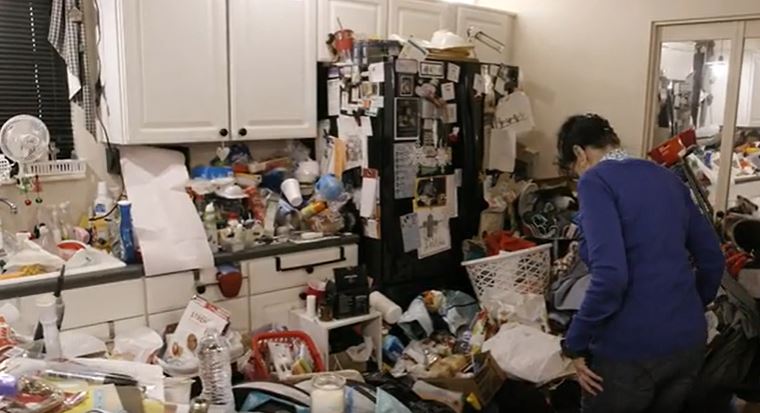
Identify the location of cabinet. The width and height of the screenshot is (760, 413). (176, 79), (264, 70), (356, 19), (409, 21), (477, 21), (261, 308), (232, 315), (116, 332).